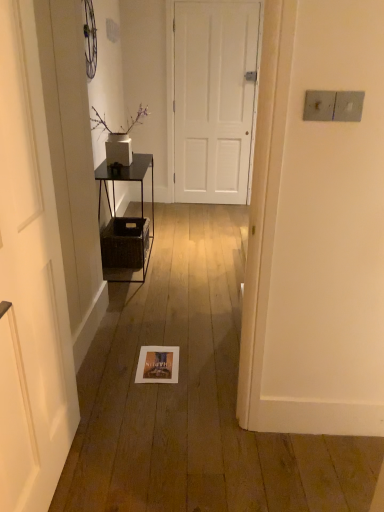
Question: From a real-world perspective, is white matte door at left, which is the 1th door from front to back, on woven brown crate at left?

Choices:
 (A) no
 (B) yes

Answer: (B)

Question: Is white matte door at left, the second door from the top, with woven brown crate at left?

Choices:
 (A) no
 (B) yes

Answer: (A)

Question: Considering the relative sizes of white matte door at left, which is the 1th door from front to back, and woven brown crate at left in the image provided, is white matte door at left, which is the 1th door from front to back, bigger than woven brown crate at left?

Choices:
 (A) yes
 (B) no

Answer: (A)

Question: Is white matte door at left, the 1th door ordered from the bottom, taller than woven brown crate at left?

Choices:
 (A) no
 (B) yes

Answer: (B)

Question: Is white matte door at left, the second door from the top, smaller than woven brown crate at left?

Choices:
 (A) yes
 (B) no

Answer: (B)

Question: Would you say white matte door at left, which appears as the second door when viewed from the back, is outside woven brown crate at left?

Choices:
 (A) yes
 (B) no

Answer: (A)

Question: Is the position of white matte door at center, the 1th door from the top, less distant than that of white matte door at left, positioned as the 2th door in right-to-left order?

Choices:
 (A) no
 (B) yes

Answer: (A)

Question: Considering the relative positions of white matte door at center, which is the 2th door from front to back, and white matte door at left, which appears as the first door when viewed from the left, in the image provided, is white matte door at center, which is the 2th door from front to back, to the right of white matte door at left, which appears as the first door when viewed from the left, from the viewer's perspective?

Choices:
 (A) no
 (B) yes

Answer: (B)

Question: Is white matte door at center, which is the 2th door from front to back, oriented away from white matte door at left, which is the 1th door from front to back?

Choices:
 (A) no
 (B) yes

Answer: (A)

Question: Can you confirm if white matte door at center, the 1th door from the top, is wider than white matte door at left, which appears as the second door when viewed from the back?

Choices:
 (A) yes
 (B) no

Answer: (B)

Question: From a real-world perspective, does white matte door at center, the second door viewed from the left, stand above white matte door at left, which appears as the first door when viewed from the left?

Choices:
 (A) no
 (B) yes

Answer: (B)

Question: Could you tell me if white matte door at center, the 1th door positioned from the back, is turned towards white matte door at left, which is the 1th door from front to back?

Choices:
 (A) yes
 (B) no

Answer: (A)

Question: From the image's perspective, is woven brown crate at left located beneath white matte door at left, the second door from the top?

Choices:
 (A) yes
 (B) no

Answer: (B)